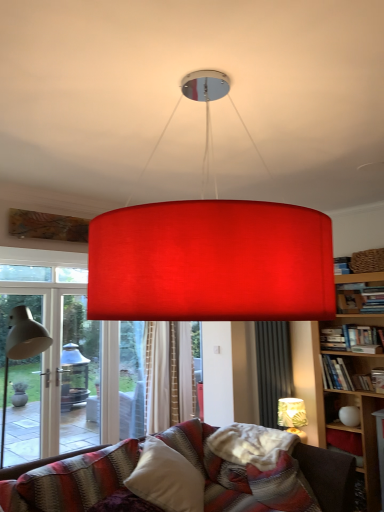
Question: Does white textured lampshade at lower right, arranged as the second lamp when viewed from the top, have a smaller size compared to matte white table lamp at left?

Choices:
 (A) yes
 (B) no

Answer: (A)

Question: Does white textured lampshade at lower right, which is the first lamp from back to front, appear on the right side of matte white table lamp at left?

Choices:
 (A) no
 (B) yes

Answer: (B)

Question: Does white textured lampshade at lower right, acting as the second lamp starting from the front, come in front of matte white table lamp at left?

Choices:
 (A) no
 (B) yes

Answer: (A)

Question: Does white textured lampshade at lower right, arranged as the second lamp when viewed from the top, have a lesser height compared to matte white table lamp at left?

Choices:
 (A) no
 (B) yes

Answer: (B)

Question: Considering the relative sizes of white textured lampshade at lower right, the first lamp positioned from the right, and matte white table lamp at left in the image provided, is white textured lampshade at lower right, the first lamp positioned from the right, thinner than matte white table lamp at left?

Choices:
 (A) yes
 (B) no

Answer: (A)

Question: From the image's perspective, is white textured lampshade at lower right, the first lamp positioned from the right, over matte white table lamp at left?

Choices:
 (A) yes
 (B) no

Answer: (B)

Question: Is matte white table lamp at left in contact with white textured lampshade at lower right, acting as the second lamp starting from the front?

Choices:
 (A) yes
 (B) no

Answer: (B)

Question: Considering the relative positions of matte white table lamp at left and white textured lampshade at lower right, arranged as the second lamp when viewed from the top, in the image provided, is matte white table lamp at left to the right of white textured lampshade at lower right, arranged as the second lamp when viewed from the top, from the viewer's perspective?

Choices:
 (A) no
 (B) yes

Answer: (A)

Question: From the image's perspective, is matte white table lamp at left above white textured lampshade at lower right, acting as the 1th lamp starting from the bottom?

Choices:
 (A) yes
 (B) no

Answer: (A)

Question: Can you confirm if matte white table lamp at left is smaller than white textured lampshade at lower right, acting as the 1th lamp starting from the bottom?

Choices:
 (A) no
 (B) yes

Answer: (A)

Question: Is matte white table lamp at left aimed at white textured lampshade at lower right, arranged as the second lamp when viewed from the top?

Choices:
 (A) no
 (B) yes

Answer: (A)

Question: From the image's perspective, would you say matte white table lamp at left is shown under white textured lampshade at lower right, which ranks as the second lamp in left-to-right order?

Choices:
 (A) no
 (B) yes

Answer: (A)

Question: Is white textured lampshade at lower right, which ranks as the second lamp in left-to-right order, shorter than matte red lampshade at center, which appears as the first lamp when viewed from the front?

Choices:
 (A) no
 (B) yes

Answer: (B)